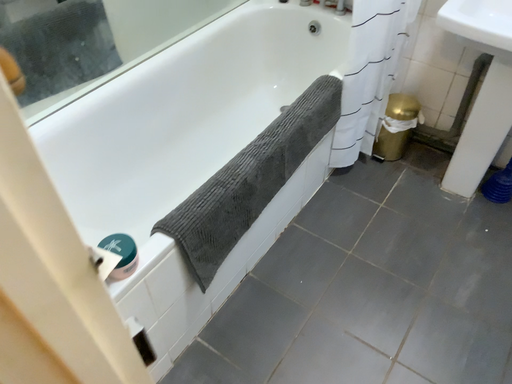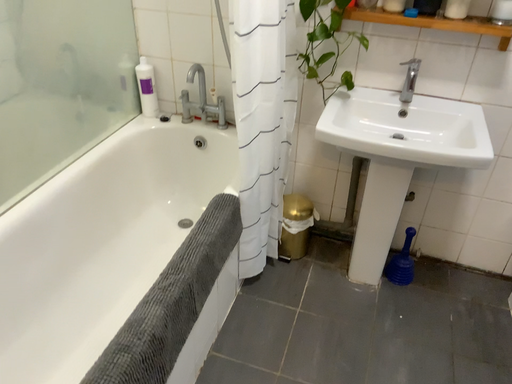
Question: Which way did the camera rotate in the video?

Choices:
 (A) rotated downward
 (B) rotated upward

Answer: (B)